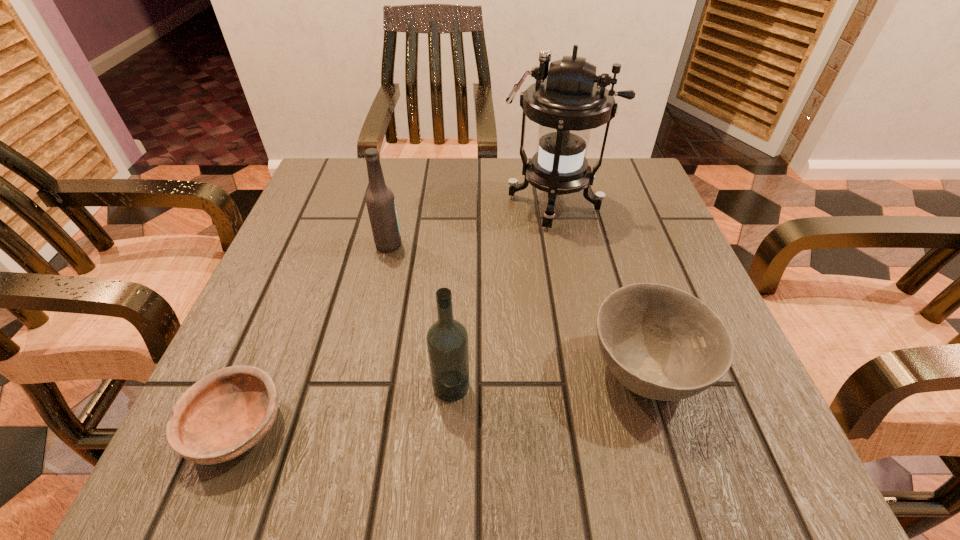
This screenshot has width=960, height=540. What are the coordinates of `object that is at the near right corner` in the screenshot? It's located at (662, 343).

In the image, there is a desktop. Identify the location of free space at the far edge. (469, 170).

The height and width of the screenshot is (540, 960). I want to click on free region at the near edge of the desktop, so click(x=516, y=415).

The height and width of the screenshot is (540, 960). In order to click on free space at the left edge of the desktop in this screenshot , I will do `click(318, 252)`.

In the image, there is a desktop. At what (x,y) coordinates should I click in order to perform the action: click on free space at the right edge. Please return your answer as a coordinate pair (x, y). Image resolution: width=960 pixels, height=540 pixels. Looking at the image, I should click on (692, 275).

Locate an element on the screen. This screenshot has width=960, height=540. vacant space at the far left corner of the desktop is located at coordinates (322, 194).

This screenshot has width=960, height=540. What are the coordinates of `free region at the far right corner` in the screenshot? It's located at (640, 205).

You are a GUI agent. You are given a task and a screenshot of the screen. Output one action in this format:
    pyautogui.click(x=<x>, y=<y>)
    Task: Click on the vacant area that lies between the left bowl and the second object from left to right
    The image size is (960, 540).
    Given the screenshot: What is the action you would take?
    pyautogui.click(x=313, y=336)

Find the location of a particular element. free area in between the left bowl and the farthest object is located at coordinates (396, 315).

Find the location of a particular element. empty location between the farthest object and the leftmost object is located at coordinates (396, 315).